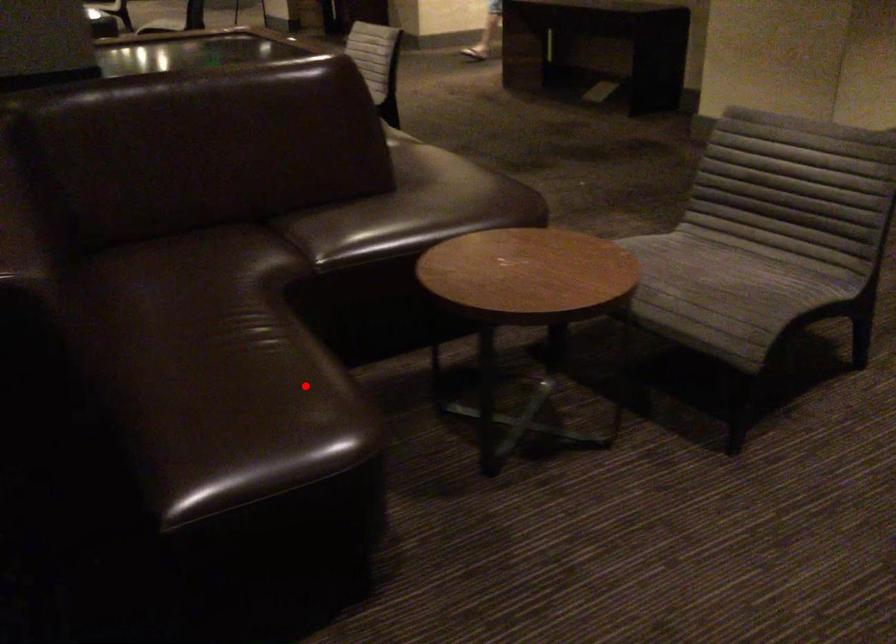
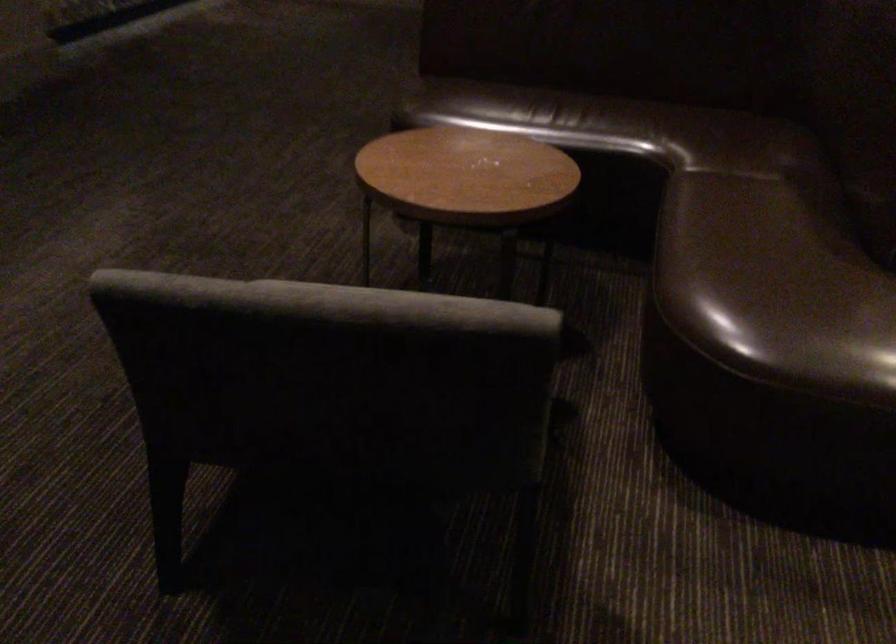
Question: I am providing you with two images of the same scene from different viewpoints. Given a red point in image1, look at the same physical point in image2. Is it:

Choices:
 (A) Closer to the viewpoint
 (B) Farther from the viewpoint

Answer: (B)